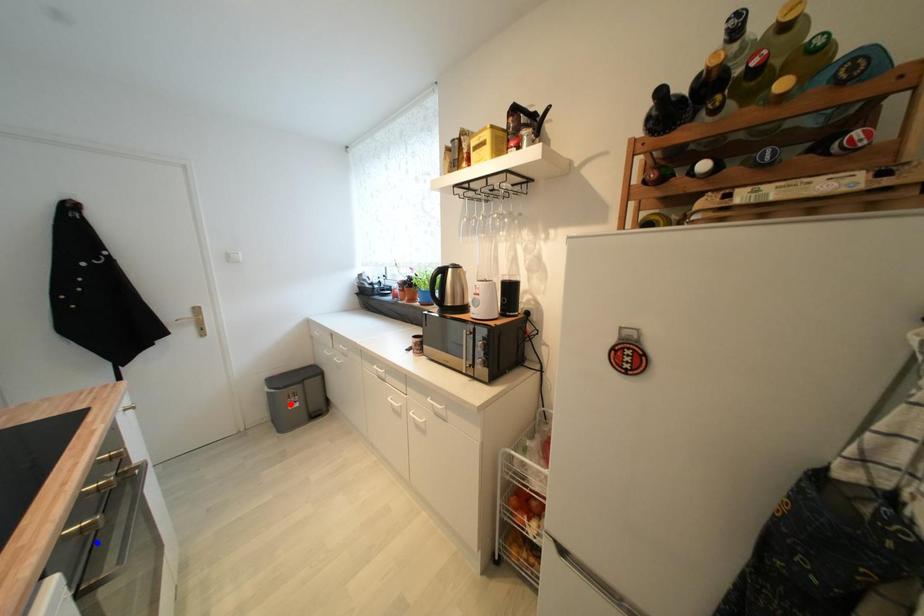
Question: Two points are marked on the image. Which point is closer to the camera?

Choices:
 (A) Blue point is closer.
 (B) Red point is closer.

Answer: (A)